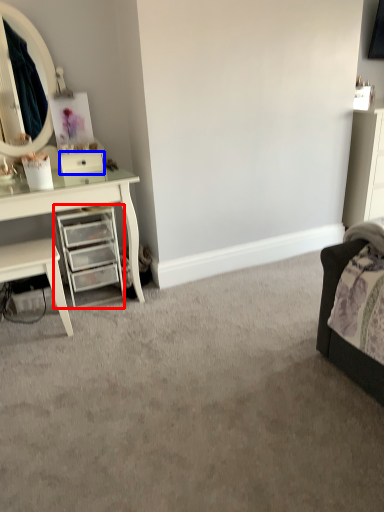
Question: Which object is closer to the camera taking this photo, chest of drawers (highlighted by a red box) or drawer (highlighted by a blue box)?

Choices:
 (A) chest of drawers
 (B) drawer

Answer: (A)